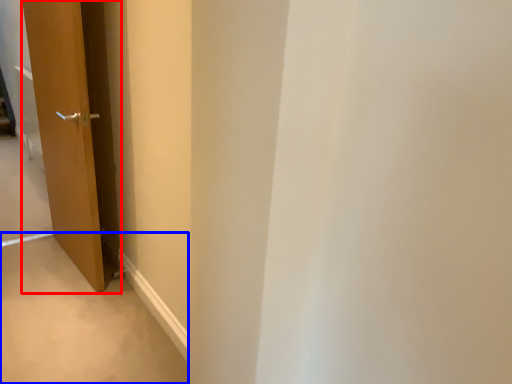
Question: Among these objects, which one is nearest to the camera, door (highlighted by a red box) or path (highlighted by a blue box)?

Choices:
 (A) door
 (B) path

Answer: (B)